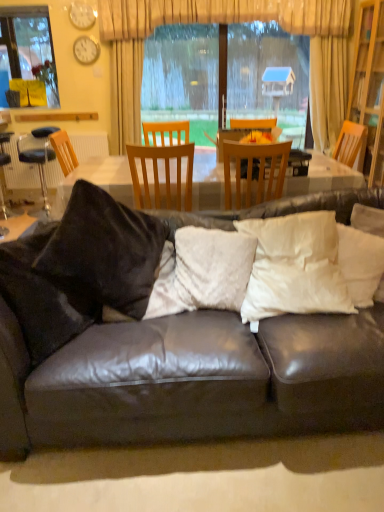
This screenshot has width=384, height=512. I want to click on clear glass window at upper left, so click(30, 46).

In order to face wooden chair at center, the second chair when ordered from left to right, should I rotate leftwards or rightwards?

Rotate your view right by about 7.754°.

Locate an element on the screen. The width and height of the screenshot is (384, 512). wooden chair at center, acting as the second chair starting from the right is located at coordinates (157, 173).

The width and height of the screenshot is (384, 512). What do you see at coordinates (86, 50) in the screenshot?
I see `matte white clock at upper left, which is the first clock in bottom-to-top order` at bounding box center [86, 50].

Locate an element on the screen. white soft pillow at center, positioned as the second pillow in left-to-right order is located at coordinates (294, 289).

Does white soft pillow at center, positioned as the second pillow in left-to-right order, have a greater width compared to wooden chair at center, acting as the second chair starting from the right?

Incorrect, the width of white soft pillow at center, positioned as the second pillow in left-to-right order, does not surpass that of wooden chair at center, acting as the second chair starting from the right.

Is white soft pillow at center, the second pillow viewed from the right, oriented towards wooden chair at center, arranged as the 1th chair when viewed from the left?

No, white soft pillow at center, the second pillow viewed from the right, is not aimed at wooden chair at center, arranged as the 1th chair when viewed from the left.

Is white soft pillow at center, positioned as the second pillow in left-to-right order, situated inside wooden chair at center, arranged as the 1th chair when viewed from the left, or outside?

The correct answer is: outside.

Is point (276, 291) in front of point (138, 202)?

Yes.

Is matte white clock at upper left, which is the first clock in bottom-to-top order, in contact with clear glass window at upper left?

No, matte white clock at upper left, which is the first clock in bottom-to-top order, is not beside clear glass window at upper left.

At what (x,y) coordinates should I click in order to perform the action: click on window on the left of the matte white clock at upper left, the 2th clock when ordered from top to bottom. Please return your answer as a coordinate pair (x, y). The image size is (384, 512). Looking at the image, I should click on (30, 46).

Is matte white clock at upper left, which is the first clock in bottom-to-top order, not inside clear glass window at upper left?

matte white clock at upper left, which is the first clock in bottom-to-top order, lies outside clear glass window at upper left's area.

Looking at this image, considering the relative sizes of matte white clock at upper left, the 2th clock when ordered from top to bottom, and clear glass window at upper left in the image provided, is matte white clock at upper left, the 2th clock when ordered from top to bottom, shorter than clear glass window at upper left?

Indeed, matte white clock at upper left, the 2th clock when ordered from top to bottom, has a lesser height compared to clear glass window at upper left.

Is white fluffy pillow at center, which appears as the 3th pillow when viewed from the right, taller than matte white clock at upper left, arranged as the 2th clock when ordered from the bottom?

Indeed, white fluffy pillow at center, which appears as the 3th pillow when viewed from the right, has a greater height compared to matte white clock at upper left, arranged as the 2th clock when ordered from the bottom.

Which of these two, white fluffy pillow at center, which appears as the 3th pillow when viewed from the right, or matte white clock at upper left, the 1th clock from the top, is smaller?

matte white clock at upper left, the 1th clock from the top.

What's the angular difference between white fluffy pillow at center, which appears as the 3th pillow when viewed from the right, and matte white clock at upper left, the 1th clock from the top,'s facing directions?

The angular difference between white fluffy pillow at center, which appears as the 3th pillow when viewed from the right, and matte white clock at upper left, the 1th clock from the top, is 6.14 degrees.

Does point (224, 290) come closer to viewer compared to point (83, 13)?

Yes, point (224, 290) is closer to viewer.

Between black leather bar stool at left and clear glass window at upper left, which one has larger width?

Wider between the two is black leather bar stool at left.

Which object is further away from the camera, black leather bar stool at left or clear glass window at upper left?

clear glass window at upper left is more distant.

From a real-world perspective, is black leather bar stool at left positioned above or below clear glass window at upper left?

Clearly, from a real-world perspective, black leather bar stool at left is below clear glass window at upper left.

Considering the positions of point (2, 150) and point (54, 100), is point (2, 150) closer or farther from the camera than point (54, 100)?

Point (2, 150) is closer to the camera than point (54, 100).

Is wooden chair at center, arranged as the 1th chair when viewed from the left, further to the viewer compared to white soft pillow at center, the second pillow viewed from the right?

Yes, wooden chair at center, arranged as the 1th chair when viewed from the left, is further from the camera.

Does wooden chair at center, acting as the second chair starting from the right, have a larger size compared to white soft pillow at center, the second pillow viewed from the right?

Yes.

From the image's perspective, is wooden chair at center, arranged as the 1th chair when viewed from the left, above or below white soft pillow at center, the second pillow viewed from the right?

From the image's perspective, wooden chair at center, arranged as the 1th chair when viewed from the left, appears above white soft pillow at center, the second pillow viewed from the right.

Looking at this image, considering their positions, is white fluffy pillow at center, which appears as the 3th pillow when viewed from the right, located in front of or behind clear glass window at upper left?

white fluffy pillow at center, which appears as the 3th pillow when viewed from the right, is positioned closer to the viewer than clear glass window at upper left.

Considering the sizes of white fluffy pillow at center, which appears as the 3th pillow when viewed from the right, and clear glass window at upper left in the image, is white fluffy pillow at center, which appears as the 3th pillow when viewed from the right, bigger or smaller than clear glass window at upper left?

Considering their sizes, white fluffy pillow at center, which appears as the 3th pillow when viewed from the right, takes up less space than clear glass window at upper left.

Is white fluffy pillow at center, which appears as the 3th pillow when viewed from the right, directly adjacent to clear glass window at upper left?

No, white fluffy pillow at center, which appears as the 3th pillow when viewed from the right, is not making contact with clear glass window at upper left.

From a real-world perspective, is matte white clock at upper left, the 2th clock when ordered from top to bottom, physically above beige fabric curtain at upper center?

Yes, from a real-world perspective, matte white clock at upper left, the 2th clock when ordered from top to bottom, is above beige fabric curtain at upper center.

Looking at this image, from the image's perspective, is matte white clock at upper left, the 2th clock when ordered from top to bottom, located above beige fabric curtain at upper center?

Yes, from the image's perspective, matte white clock at upper left, the 2th clock when ordered from top to bottom, is on top of beige fabric curtain at upper center.

Between matte white clock at upper left, which is the first clock in bottom-to-top order, and beige fabric curtain at upper center, which one is positioned in front?

beige fabric curtain at upper center is in front.

In the scene shown: Based on their positions, is matte white clock at upper left, which is the first clock in bottom-to-top order, located to the left or right of beige fabric curtain at upper center?

Based on their positions, matte white clock at upper left, which is the first clock in bottom-to-top order, is located to the left of beige fabric curtain at upper center.

Find the location of a particular element. the 2nd pillow to the right of the wooden chair at center, acting as the second chair starting from the right, starting your count from the anchor is located at coordinates (294, 289).

Where is `window above the matte white clock at upper left, which is the first clock in bottom-to-top order (from the image's perspective)`? The height and width of the screenshot is (512, 384). window above the matte white clock at upper left, which is the first clock in bottom-to-top order (from the image's perspective) is located at coordinates (30, 46).

Looking at the image, which one is located closer to clear glass window at upper left, wooden bookshelf at right or matte white clock at upper left, which is the first clock in bottom-to-top order?

matte white clock at upper left, which is the first clock in bottom-to-top order, is positioned closer to the anchor clear glass window at upper left.

Looking at the image, which one is located closer to black leather bar stool at left, wooden chair at center, acting as the 1th chair starting from the right, or leather couch with pillows at center?

wooden chair at center, acting as the 1th chair starting from the right, is closer to black leather bar stool at left.

Considering their positions, is white soft pillow at center, the second pillow viewed from the right, positioned closer to wooden chair at center, arranged as the 1th chair when viewed from the left, than white fluffy pillow at center, which appears as the 3th pillow when viewed from the right?

white fluffy pillow at center, which appears as the 3th pillow when viewed from the right.

Which object lies further to the anchor point wooden chair at center, acting as the 1th chair starting from the right, matte white clock at upper left, which is the first clock in bottom-to-top order, or white soft pillow at center, the second pillow viewed from the right?

Based on the image, matte white clock at upper left, which is the first clock in bottom-to-top order, appears to be further to wooden chair at center, acting as the 1th chair starting from the right.

When comparing their distances from matte white clock at upper left, which is the first clock in bottom-to-top order, does white fluffy pillow at center, arranged as the 1th pillow when viewed from the left, or leather couch with pillows at center seem closer?

The object closer to matte white clock at upper left, which is the first clock in bottom-to-top order, is white fluffy pillow at center, arranged as the 1th pillow when viewed from the left.

Based on the photo, which object lies further to the anchor point wooden chair at center, acting as the second chair starting from the right, white soft pillow at right, which ranks as the 1th pillow in right-to-left order, or black leather bar stool at left?

black leather bar stool at left.

Estimate the real-world distances between objects in this image. Which object is closer to matte white clock at upper left, the 2th clock when ordered from top to bottom, wooden chair at center, the second chair when ordered from left to right, or wooden bookshelf at right?

wooden bookshelf at right lies closer to matte white clock at upper left, the 2th clock when ordered from top to bottom, than the other object.

Based on their spatial positions, is black leather bar stool at left or white soft pillow at center, the second pillow viewed from the right, further from matte white clock at upper left, arranged as the 2th clock when ordered from the bottom?

Based on the image, white soft pillow at center, the second pillow viewed from the right, appears to be further to matte white clock at upper left, arranged as the 2th clock when ordered from the bottom.

Identify the location of cabinetry between leather couch with pillows at center and beige fabric curtain at upper center in the front-back direction. (369, 80).

Where is `clock between clear glass window at upper left and black leather bar stool at left in the vertical direction`? The image size is (384, 512). clock between clear glass window at upper left and black leather bar stool at left in the vertical direction is located at coordinates (86, 50).

I want to click on bar stool positioned between white fluffy pillow at center, which appears as the 3th pillow when viewed from the right, and clear glass window at upper left from near to far, so click(x=4, y=151).

This screenshot has width=384, height=512. What are the coordinates of `pillow located between white fluffy pillow at center, which appears as the 3th pillow when viewed from the right, and clear glass window at upper left in the depth direction` in the screenshot? It's located at (360, 263).